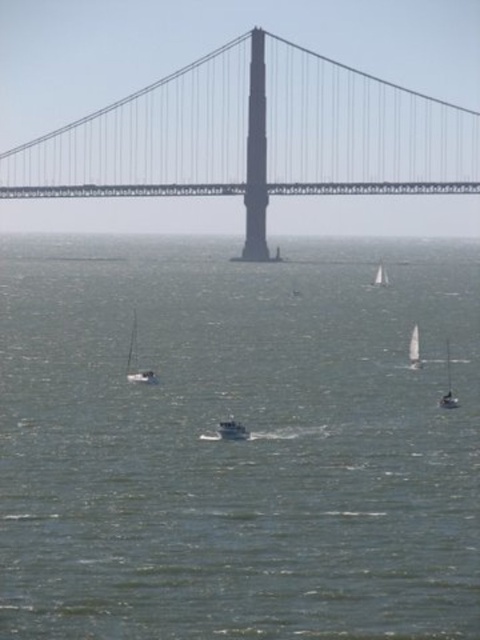
Question: Considering the real-world distances, which object is closest to the white matte boat at center?

Choices:
 (A) metallic gray suspension bridge at center
 (B) white matte sailboat at left
 (C) white sailboat at center
 (D) greenish-blue water at center

Answer: (B)

Question: Which point appears closest to the camera in this image?

Choices:
 (A) (130, 348)
 (B) (249, 188)
 (C) (382, 285)

Answer: (A)

Question: Where is greenish-blue water at center located in relation to white sailboat at center in the image?

Choices:
 (A) below
 (B) above

Answer: (A)

Question: Where is greenish-blue water at center located in relation to white matte boat at center in the image?

Choices:
 (A) left
 (B) right

Answer: (A)

Question: Among these points, which one is farthest from the camera?

Choices:
 (A) (410, 339)
 (B) (220, 435)
 (C) (385, 275)
 (D) (136, 376)

Answer: (C)

Question: From the image, what is the correct spatial relationship of greenish-blue water at center in relation to white sailboat at right?

Choices:
 (A) left
 (B) right

Answer: (A)